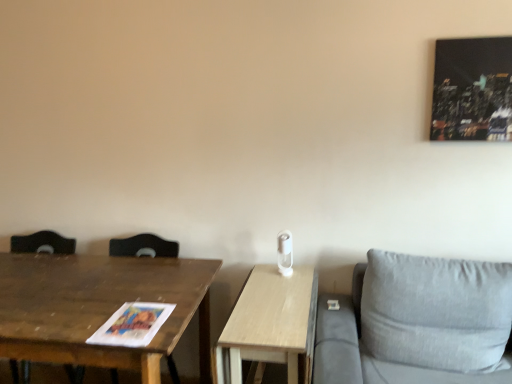
Measure the distance between point (214,362) and camera.

Point (214,362) is 6.44 feet from camera.

The image size is (512, 384). I want to click on brown wooden swivel chair at left, so click(42, 243).

The image size is (512, 384). What do you see at coordinates (42, 243) in the screenshot? I see `brown wooden swivel chair at left` at bounding box center [42, 243].

This screenshot has width=512, height=384. Identify the location of wooden table at left, placed as the 2th table when sorted from right to left. (99, 307).

Where is `wooden table at center, the second table when ordered from left to right`? This screenshot has height=384, width=512. wooden table at center, the second table when ordered from left to right is located at coordinates (271, 324).

Considering the relative positions of wooden table at center, marked as the first table in a right-to-left arrangement, and brown wooden swivel chair at left in the image provided, is wooden table at center, marked as the first table in a right-to-left arrangement, to the left or to the right of brown wooden swivel chair at left?

In the image, wooden table at center, marked as the first table in a right-to-left arrangement, appears on the right side of brown wooden swivel chair at left.

Which is in front, wooden table at center, marked as the first table in a right-to-left arrangement, or brown wooden swivel chair at left?

Positioned in front is wooden table at center, marked as the first table in a right-to-left arrangement.

From the image's perspective, is wooden table at center, marked as the first table in a right-to-left arrangement, above or below brown wooden swivel chair at left?

wooden table at center, marked as the first table in a right-to-left arrangement, is below brown wooden swivel chair at left.

Is wooden table at center, marked as the first table in a right-to-left arrangement, bigger than brown wooden swivel chair at left?

Incorrect, wooden table at center, marked as the first table in a right-to-left arrangement, is not larger than brown wooden swivel chair at left.

Where is `table lying behind the wooden table at left, marked as the first table in a left-to-right arrangement`? Image resolution: width=512 pixels, height=384 pixels. table lying behind the wooden table at left, marked as the first table in a left-to-right arrangement is located at coordinates point(271,324).

Is wooden table at left, marked as the first table in a left-to-right arrangement, at the left side of wooden table at center, marked as the first table in a right-to-left arrangement?

Correct, you'll find wooden table at left, marked as the first table in a left-to-right arrangement, to the left of wooden table at center, marked as the first table in a right-to-left arrangement.

From the image's perspective, is wooden table at left, placed as the 2th table when sorted from right to left, above wooden table at center, marked as the first table in a right-to-left arrangement?

Indeed, from the image's perspective, wooden table at left, placed as the 2th table when sorted from right to left, is shown above wooden table at center, marked as the first table in a right-to-left arrangement.

Which is in front, point (201, 367) or point (277, 341)?

The point (277, 341) is closer.

From the picture: Which object is more forward, wooden table at center, marked as the first table in a right-to-left arrangement, or wooden table at left, placed as the 2th table when sorted from right to left?

wooden table at left, placed as the 2th table when sorted from right to left.

Is wooden table at center, the second table when ordered from left to right, situated inside wooden table at left, placed as the 2th table when sorted from right to left, or outside?

wooden table at center, the second table when ordered from left to right, is not enclosed by wooden table at left, placed as the 2th table when sorted from right to left.

From the image's perspective, who appears lower, wooden table at center, the second table when ordered from left to right, or wooden table at left, marked as the first table in a left-to-right arrangement?

wooden table at center, the second table when ordered from left to right.

Is wooden table at center, marked as the first table in a right-to-left arrangement, oriented towards wooden table at left, placed as the 2th table when sorted from right to left?

No.

Are brown wooden swivel chair at left and wooden table at left, marked as the first table in a left-to-right arrangement, beside each other?

brown wooden swivel chair at left and wooden table at left, marked as the first table in a left-to-right arrangement, are clearly separated.

From the image's perspective, is brown wooden swivel chair at left on wooden table at left, marked as the first table in a left-to-right arrangement?

Yes, from the image's perspective, brown wooden swivel chair at left is on top of wooden table at left, marked as the first table in a left-to-right arrangement.

Starting from the brown wooden swivel chair at left, which table is the 1st one to the right? Please provide its 2D coordinates.

[(99, 307)]

Is brown wooden swivel chair at left positioned before wooden table at left, marked as the first table in a left-to-right arrangement?

No, it is behind wooden table at left, marked as the first table in a left-to-right arrangement.

Is brown wooden swivel chair at left positioned in front of wooden table at center, marked as the first table in a right-to-left arrangement?

No, it is behind wooden table at center, marked as the first table in a right-to-left arrangement.

Is point (54, 238) closer to viewer compared to point (258, 296)?

No, it is behind (258, 296).

Could you tell me if brown wooden swivel chair at left is turned towards wooden table at center, the second table when ordered from left to right?

No, brown wooden swivel chair at left is not aimed at wooden table at center, the second table when ordered from left to right.

Looking at this image, which is more to the left, wooden table at left, marked as the first table in a left-to-right arrangement, or brown wooden swivel chair at left?

From the viewer's perspective, brown wooden swivel chair at left appears more on the left side.

From their relative heights in the image, would you say wooden table at left, placed as the 2th table when sorted from right to left, is taller or shorter than brown wooden swivel chair at left?

wooden table at left, placed as the 2th table when sorted from right to left, is shorter than brown wooden swivel chair at left.

Which table is the 1st one when counting from the right side of the brown wooden swivel chair at left? Please provide its 2D coordinates.

[(99, 307)]

Consider the image. How different are the orientations of wooden table at left, marked as the first table in a left-to-right arrangement, and brown wooden swivel chair at left in degrees?

They differ by 0.413 degrees in their facing directions.

From a real-world perspective, which table is the 2nd one underneath the brown wooden swivel chair at left? Please provide its 2D coordinates.

[(271, 324)]

The height and width of the screenshot is (384, 512). What are the coordinates of `table above the wooden table at center, marked as the first table in a right-to-left arrangement (from a real-world perspective)` in the screenshot? It's located at (99, 307).

From the image, which object appears to be nearer to wooden table at center, marked as the first table in a right-to-left arrangement, brown wooden swivel chair at left or wooden table at left, placed as the 2th table when sorted from right to left?

wooden table at left, placed as the 2th table when sorted from right to left.

Considering their positions, is wooden table at center, the second table when ordered from left to right, positioned closer to wooden table at left, placed as the 2th table when sorted from right to left, than brown wooden swivel chair at left?

wooden table at center, the second table when ordered from left to right.

From the image, which object appears to be nearer to wooden table at center, the second table when ordered from left to right, wooden table at left, marked as the first table in a left-to-right arrangement, or brown wooden swivel chair at left?

wooden table at left, marked as the first table in a left-to-right arrangement, is closer to wooden table at center, the second table when ordered from left to right.

Based on their spatial positions, is wooden table at center, marked as the first table in a right-to-left arrangement, or wooden table at left, placed as the 2th table when sorted from right to left, closer to brown wooden swivel chair at left?

wooden table at left, placed as the 2th table when sorted from right to left, lies closer to brown wooden swivel chair at left than the other object.

In the scene shown: Looking at the image, which one is located further to brown wooden swivel chair at left, wooden table at left, marked as the first table in a left-to-right arrangement, or wooden table at center, the second table when ordered from left to right?

The object further to brown wooden swivel chair at left is wooden table at center, the second table when ordered from left to right.

Considering their positions, is brown wooden swivel chair at left positioned further to wooden table at left, marked as the first table in a left-to-right arrangement, than wooden table at center, the second table when ordered from left to right?

Based on the image, brown wooden swivel chair at left appears to be further to wooden table at left, marked as the first table in a left-to-right arrangement.

At what (x,y) coordinates should I click in order to perform the action: click on table between brown wooden swivel chair at left and wooden table at center, the second table when ordered from left to right. Please return your answer as a coordinate pair (x, y). The width and height of the screenshot is (512, 384). Looking at the image, I should click on (99, 307).